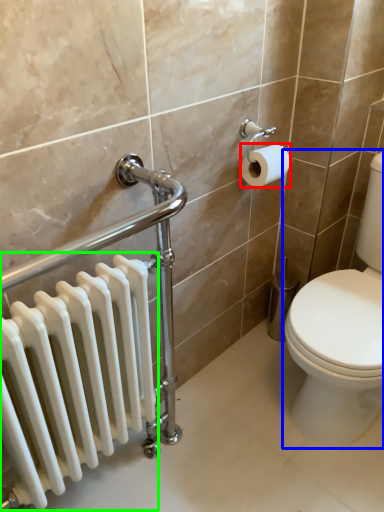
Question: Considering the real-world distances, which object is farthest from toilet paper (highlighted by a red box)? toilet (highlighted by a blue box) or radiator (highlighted by a green box)?

Choices:
 (A) toilet
 (B) radiator

Answer: (B)